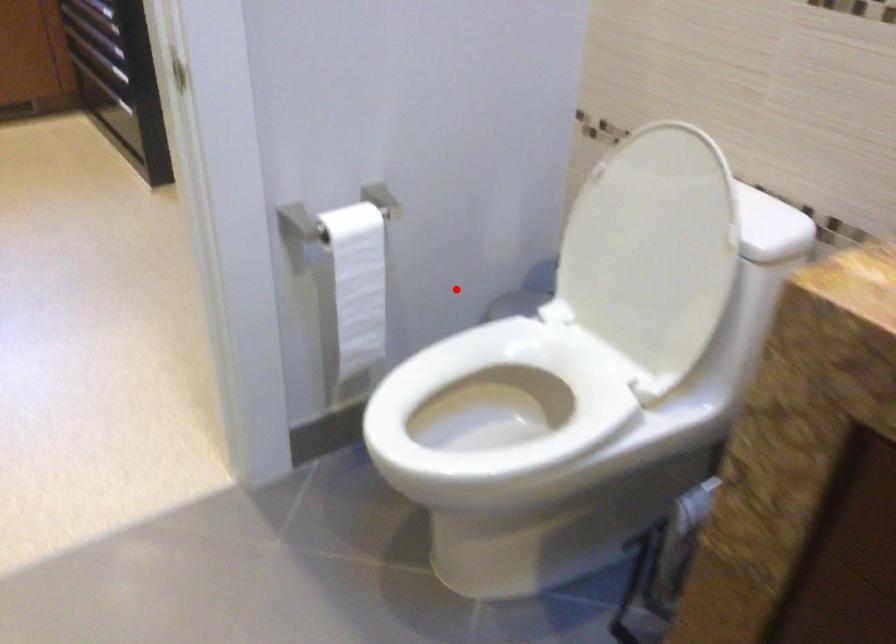
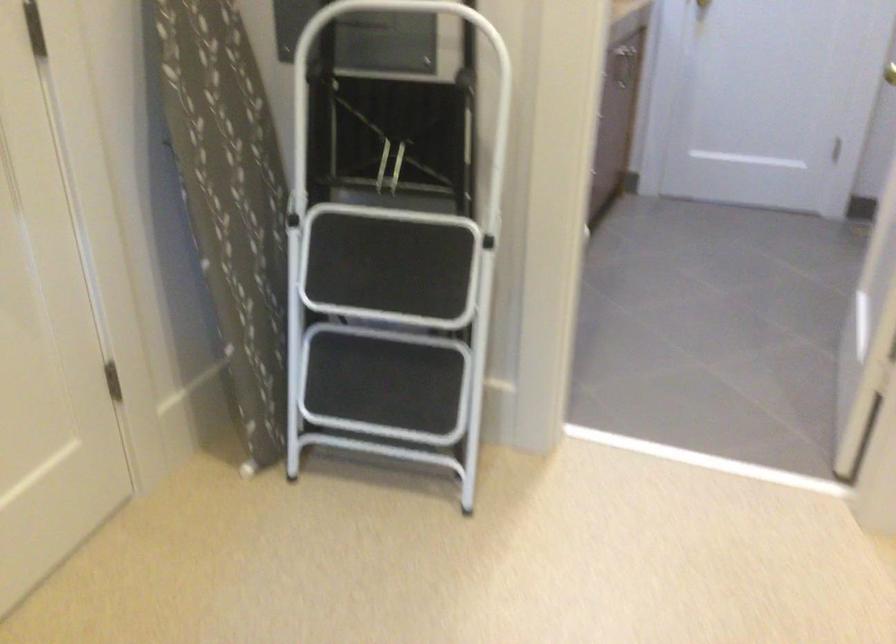
Question: I am providing you with two images of the same scene from different viewpoints. A red point is shown in image1. For the corresponding object point in image2, is it positioned nearer or farther from the camera?

Choices:
 (A) Nearer
 (B) Farther

Answer: (B)